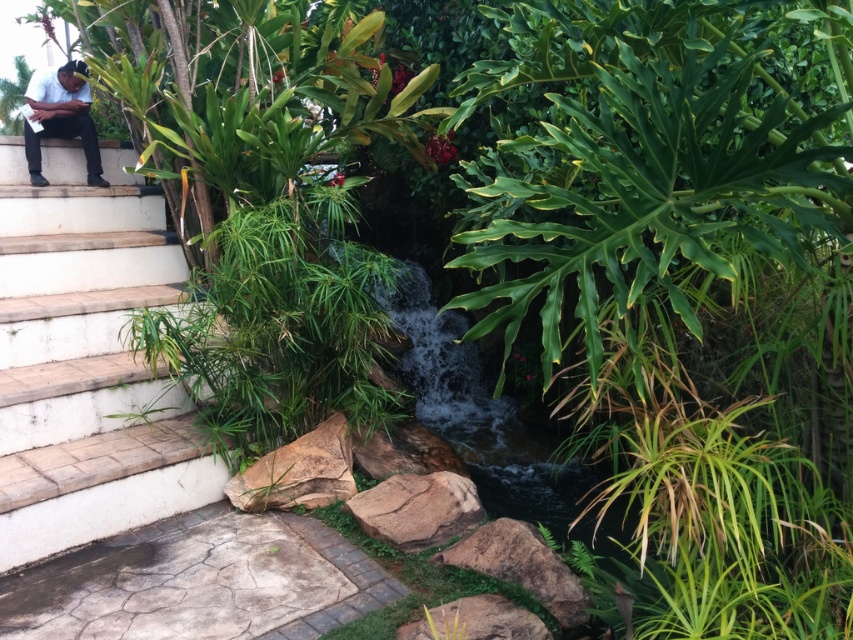
Locate an element on the screen. This screenshot has width=853, height=640. white stone stairs at left is located at coordinates (86, 358).

Is white stone stairs at left wider than black matte clothing at left?

Yes, white stone stairs at left is wider than black matte clothing at left.

I want to click on white stone stairs at left, so click(86, 358).

I want to click on white stone stairs at left, so click(x=86, y=358).